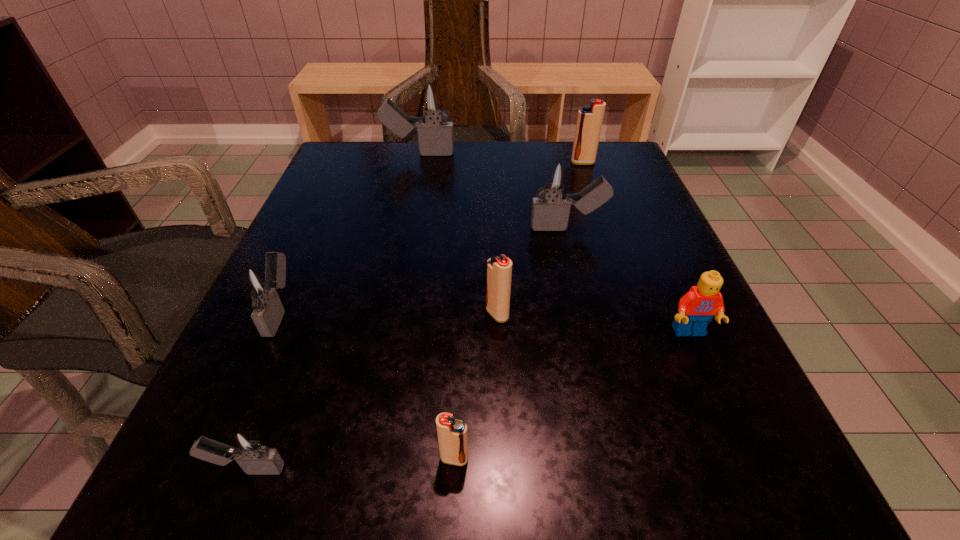
What are the coordinates of `the leftmost red igniter` in the screenshot? It's located at (452, 434).

Where is `the nearest red igniter`? This screenshot has height=540, width=960. the nearest red igniter is located at coordinates pyautogui.click(x=452, y=434).

At what (x,y) coordinates should I click in order to perform the action: click on the nearest gray igniter. Please return your answer as a coordinate pair (x, y). The height and width of the screenshot is (540, 960). Looking at the image, I should click on (246, 445).

Image resolution: width=960 pixels, height=540 pixels. In order to click on vacant space located 0.070m on the front of the tallest igniter in this screenshot , I will do `click(414, 178)`.

Identify the location of free space located 0.250m on the left of the farthest red igniter. The width and height of the screenshot is (960, 540). (466, 163).

Where is `vacant space situated 0.300m on the front of the third farthest igniter`? The width and height of the screenshot is (960, 540). vacant space situated 0.300m on the front of the third farthest igniter is located at coordinates (603, 375).

You are a GUI agent. You are given a task and a screenshot of the screen. Output one action in this format:
    pyautogui.click(x=<x>, y=<y>)
    Task: Click on the free space located on the front of the third farthest gray igniter
    The image size is (960, 540).
    Given the screenshot: What is the action you would take?
    pyautogui.click(x=239, y=405)

Where is `free spot located on the right of the fifth object from left to right`? The width and height of the screenshot is (960, 540). free spot located on the right of the fifth object from left to right is located at coordinates (604, 314).

The width and height of the screenshot is (960, 540). What are the coordinates of `free space located on the face of the rightmost object` in the screenshot? It's located at (718, 396).

Image resolution: width=960 pixels, height=540 pixels. I want to click on vacant space located 0.260m on the left of the smallest red igniter, so click(222, 458).